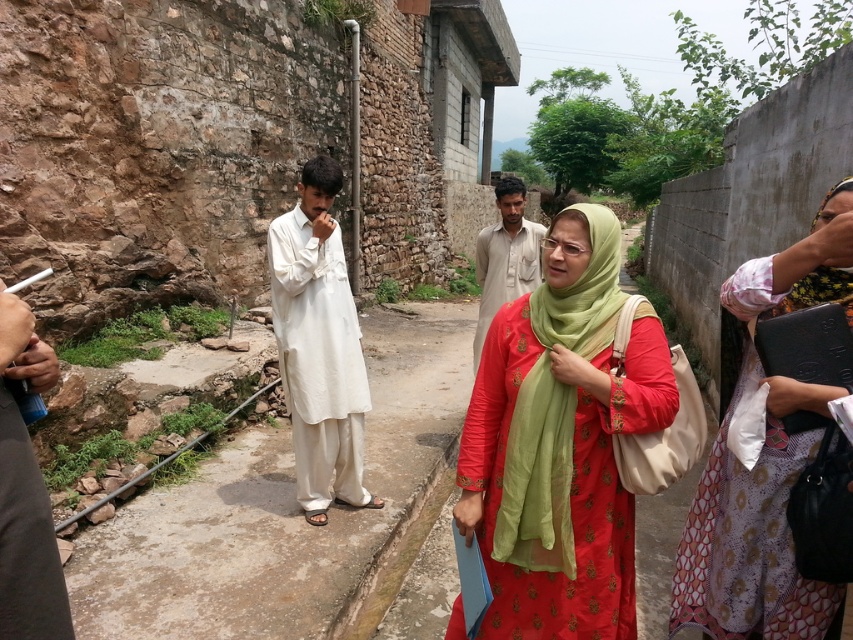
Question: Is white cotton kurta at center behind light brown cotton shirt at center?

Choices:
 (A) no
 (B) yes

Answer: (A)

Question: Considering the real-world distances, which object is farthest from the metallic blue can at left?

Choices:
 (A) light brown cotton shirt at center
 (B) white plastic cigarette at center
 (C) white cotton shirt at center

Answer: (B)

Question: Can you confirm if matte red dress at center is smaller than white plastic cigarette at center?

Choices:
 (A) no
 (B) yes

Answer: (A)

Question: Is patterned fabric dress at right below white plastic cigarette at center?

Choices:
 (A) yes
 (B) no

Answer: (A)

Question: Which point is farther from the camera taking this photo?

Choices:
 (A) (316, 508)
 (B) (549, 636)
 (C) (26, 276)

Answer: (C)

Question: Which point is farther to the camera?

Choices:
 (A) patterned fabric dress at right
 (B) white cotton kurta at center
 (C) light brown cotton shirt at center
 (D) matte red dress at center

Answer: (C)